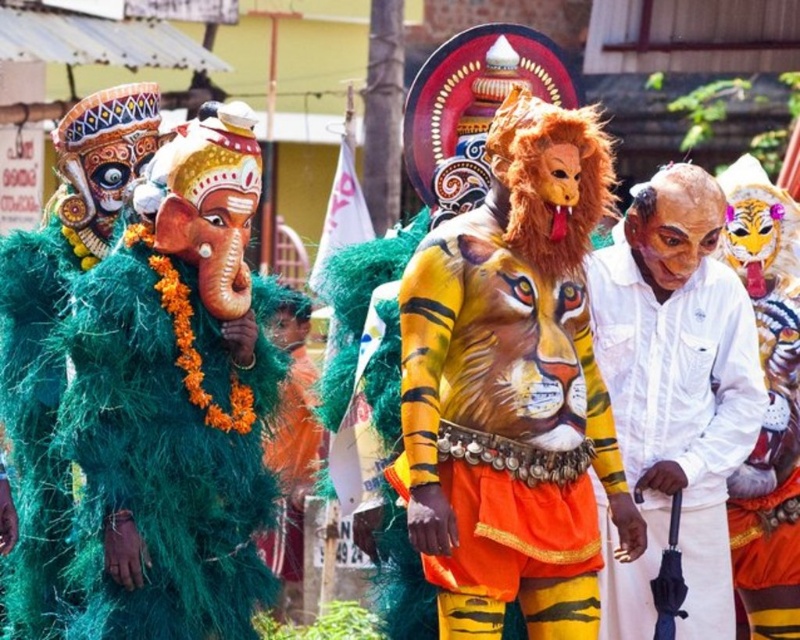
Does painted tiger body art at center come in front of white cotton shirt at center?

Yes, painted tiger body art at center is in front of white cotton shirt at center.

Find the location of a particular element. Image resolution: width=800 pixels, height=640 pixels. painted tiger body art at center is located at coordinates (504, 428).

Describe the element at coordinates (504, 428) in the screenshot. This screenshot has height=640, width=800. I see `painted tiger body art at center` at that location.

The height and width of the screenshot is (640, 800). What are the coordinates of `painted tiger body art at center` in the screenshot? It's located at (504, 428).